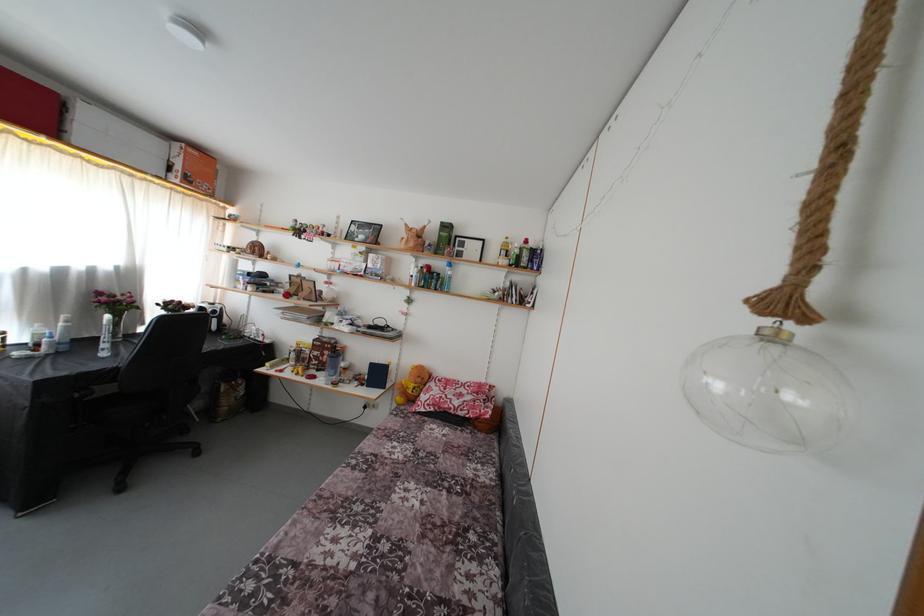
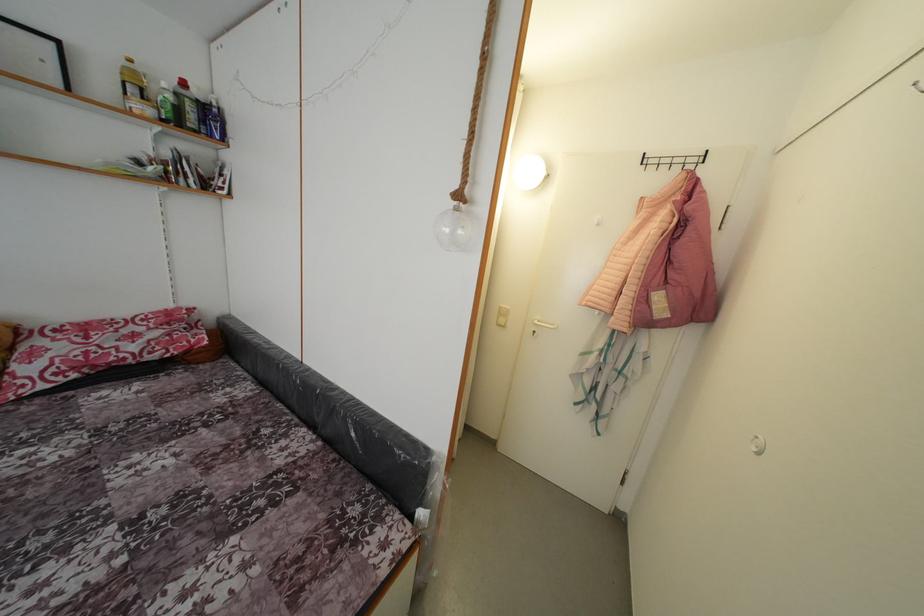
Looking at this image, the first image is from the beginning of the video and the second image is from the end. How did the camera likely rotate when shooting the video?

The camera rotated toward right-down.